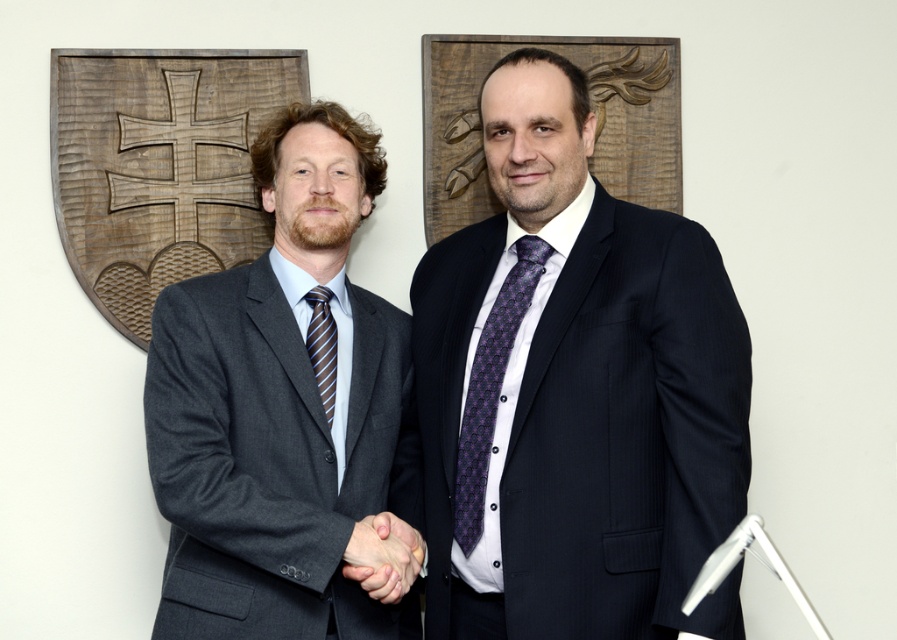
You are standing in the room where the two men are shaking hands. You need to locate the matte black suit at center. Which direction should you look relative to the two men?

The matte black suit at center is located at point coordinates 0.613 on the x axis and 0.641 on the y axis. Since the two men are shaking hands in the center of the image, you should look directly at them to find the matte black suit at center.

You are an event photographer trying to capture the handshake between the two men. You notice the purple printed tie at center and the smooth skin handshake at center. Which object is closer to your camera lens?

The purple printed tie at center is closer to the camera lens because it is further to the viewer than the smooth skin handshake at center.